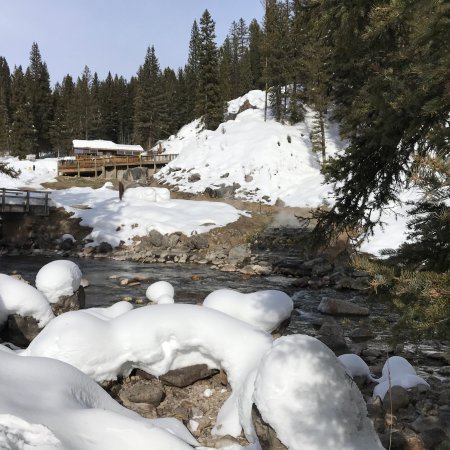
Find the location of a particular element. Image resolution: width=450 pixels, height=450 pixels. hand rails is located at coordinates (4, 191).